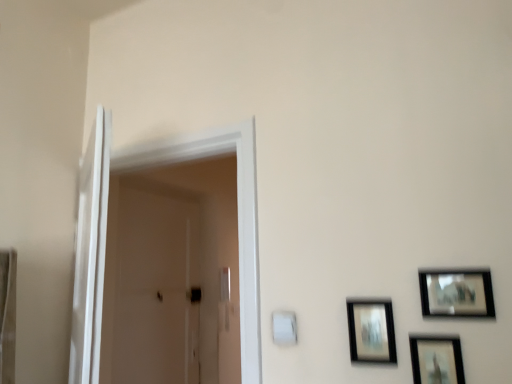
Question: In terms of width, does white glossy door at left look wider or thinner when compared to white glossy screen door at left, the 2th screen door viewed from the back?

Choices:
 (A) thin
 (B) wide

Answer: (B)

Question: Considering the positions of white glossy door at left and white glossy screen door at left, the 2th screen door viewed from the back, in the image, is white glossy door at left taller or shorter than white glossy screen door at left, the 2th screen door viewed from the back,?

Choices:
 (A) tall
 (B) short

Answer: (A)

Question: Which is farther from the white glossy door at left?

Choices:
 (A) white glossy screen door at left, the 2th screen door viewed from the back
 (B) white plastic light switch at lower center
 (C) matte black picture frame at lower right, the 3th picture frame when ordered from right to left
 (D) matte black picture frame at upper right, which is counted as the third picture frame, starting from the left
 (E) white glossy door at left, the 2th screen door in the front-to-back sequence

Answer: (D)

Question: Which of these objects is positioned closest to the matte black picture frame at lower right, the 3th picture frame when ordered from right to left?

Choices:
 (A) white plastic light switch at lower center
 (B) white glossy door at left
 (C) white glossy screen door at left, the 1th screen door positioned from the front
 (D) white glossy door at left, the 2th screen door in the front-to-back sequence
 (E) matte black picture frame at lower right, the second picture frame viewed from the left

Answer: (E)